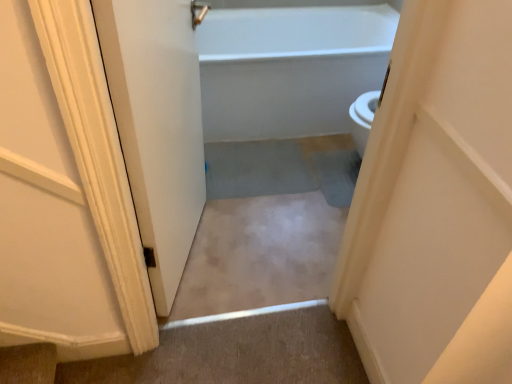
This screenshot has height=384, width=512. What do you see at coordinates (436, 204) in the screenshot? I see `white matte door at center` at bounding box center [436, 204].

I want to click on white matte door at center, so click(x=436, y=204).

Where is `white matte door at center`? white matte door at center is located at coordinates (436, 204).